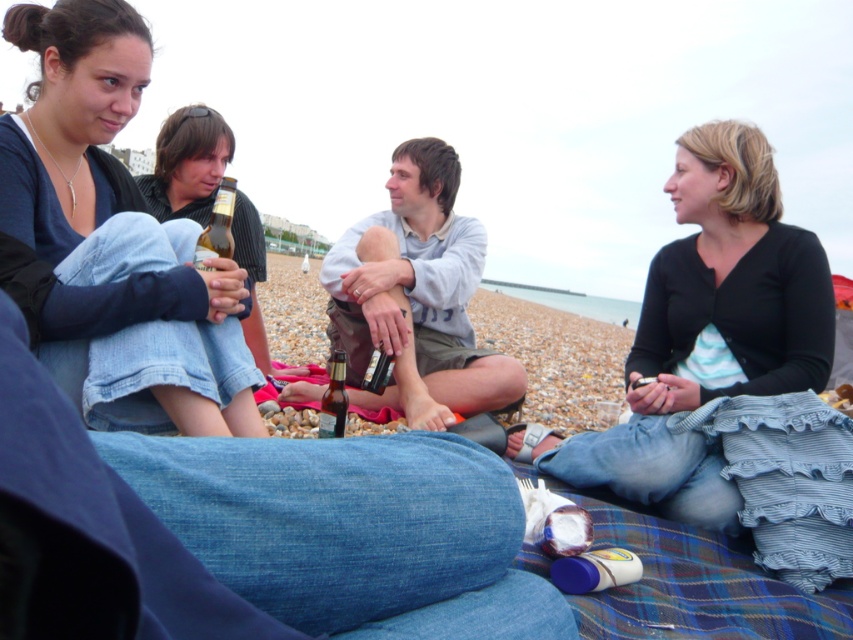
Can you confirm if denim jeans at left is thinner than translucent plastic bottle at center?

No.

At what (x,y) coordinates should I click in order to perform the action: click on denim jeans at left. Please return your answer as a coordinate pair (x, y). This screenshot has height=640, width=853. Looking at the image, I should click on (115, 234).

Locate an element on the screen. The height and width of the screenshot is (640, 853). denim jeans at left is located at coordinates (115, 234).

Where is `denim jeans at left`? The image size is (853, 640). denim jeans at left is located at coordinates (115, 234).

Between black cotton shirt at upper right and translucent plastic bottle at center, which one appears on the right side from the viewer's perspective?

black cotton shirt at upper right is more to the right.

Does black cotton shirt at upper right appear on the left side of translucent plastic bottle at center?

In fact, black cotton shirt at upper right is to the right of translucent plastic bottle at center.

Does point (677, 243) come in front of point (383, 355)?

Yes, it is in front of point (383, 355).

You are a GUI agent. You are given a task and a screenshot of the screen. Output one action in this format:
    pyautogui.click(x=<x>, y=<y>)
    Task: Click on the black cotton shirt at upper right
    The image size is (853, 640).
    Given the screenshot: What is the action you would take?
    pyautogui.click(x=706, y=332)

Looking at this image, does denim jeans at left appear on the right side of matte black shirt at left?

Yes, denim jeans at left is to the right of matte black shirt at left.

Is point (136, 97) positioned behind point (193, 113)?

No, it is not.

Image resolution: width=853 pixels, height=640 pixels. What do you see at coordinates (115, 234) in the screenshot?
I see `denim jeans at left` at bounding box center [115, 234].

Image resolution: width=853 pixels, height=640 pixels. Identify the location of denim jeans at left. (115, 234).